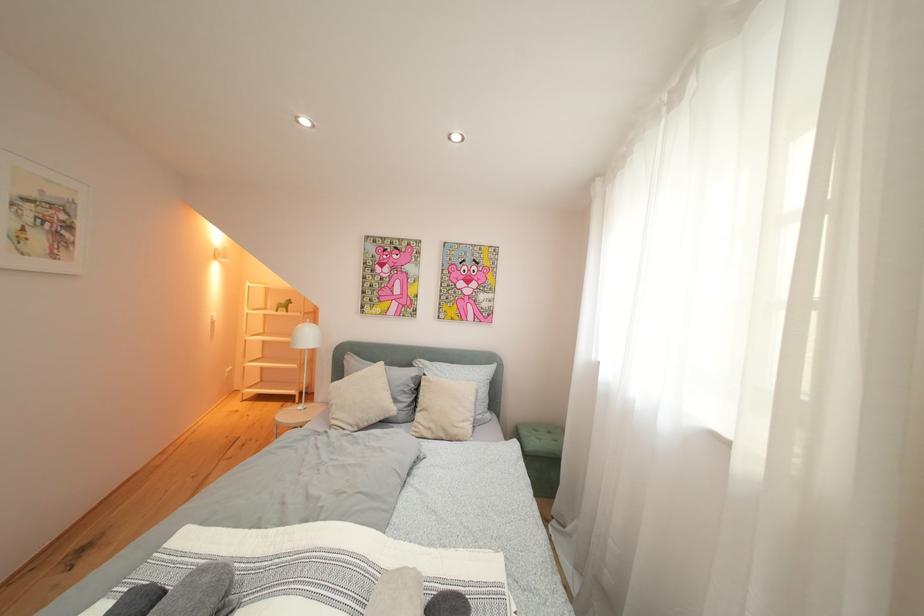
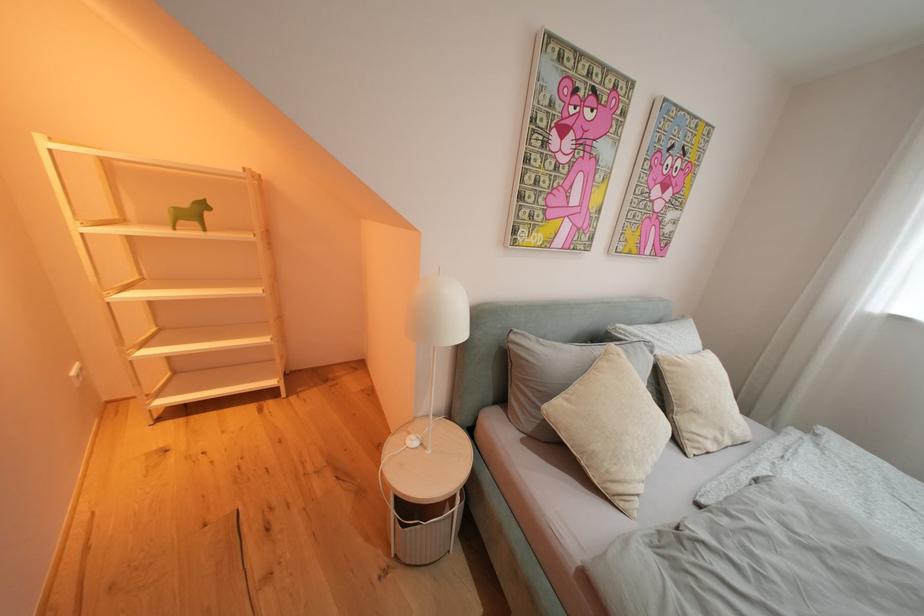
In a continuous first-person perspective shot, in which direction is the camera moving?

The cameraman moved toward left, forward.